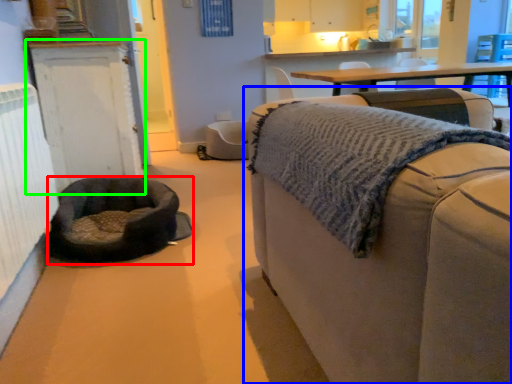
Question: Which object is the closest to the dog bed (highlighted by a red box)? Choose among these: studio couch (highlighted by a blue box) or cabinetry (highlighted by a green box).

Choices:
 (A) studio couch
 (B) cabinetry

Answer: (B)